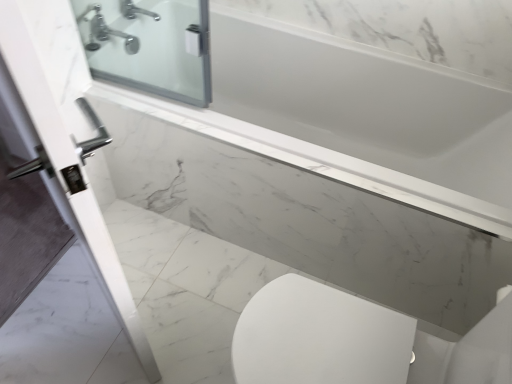
Question: From the image's perspective, is white glossy door handle at left positioned above or below white marble ledge at upper center?

Choices:
 (A) above
 (B) below

Answer: (A)

Question: Relative to white marble ledge at upper center, is white glossy door handle at left in front or behind?

Choices:
 (A) behind
 (B) front

Answer: (B)

Question: Which is nearer to the white marble ledge at upper center?

Choices:
 (A) white glossy door handle at left
 (B) silver metallic faucet at upper left

Answer: (A)

Question: Which of these objects is positioned farthest from the white marble ledge at upper center?

Choices:
 (A) silver metallic faucet at upper left
 (B) white glossy door handle at left

Answer: (A)